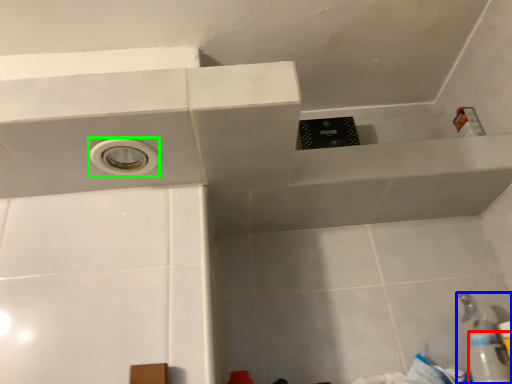
Question: Which object is the closest to the bottle (highlighted by a red box)? Choose among these: plumbing fixture (highlighted by a blue box) or hole (highlighted by a green box).

Choices:
 (A) plumbing fixture
 (B) hole

Answer: (A)